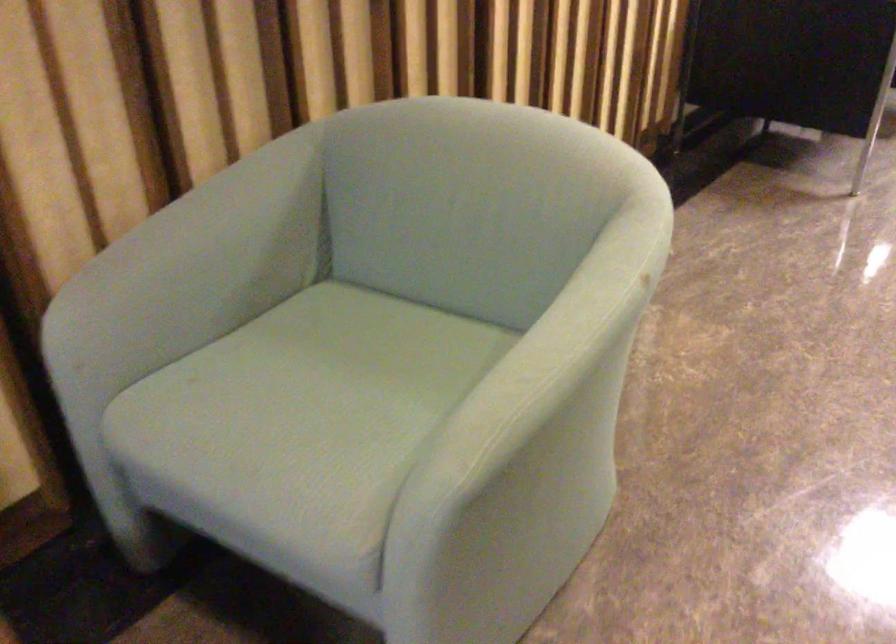
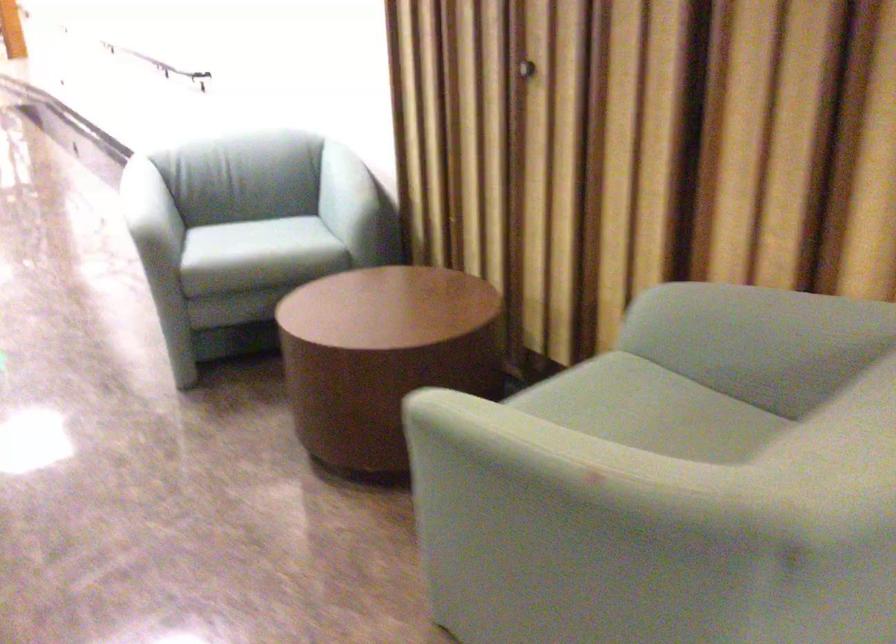
In the second image, find the point that corresponds to (x=300, y=370) in the first image.

(650, 410)